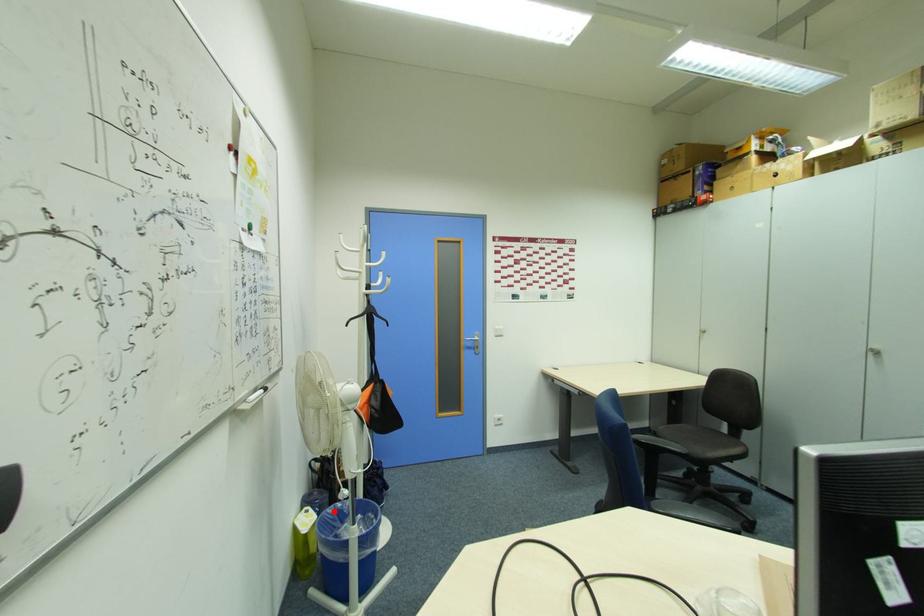
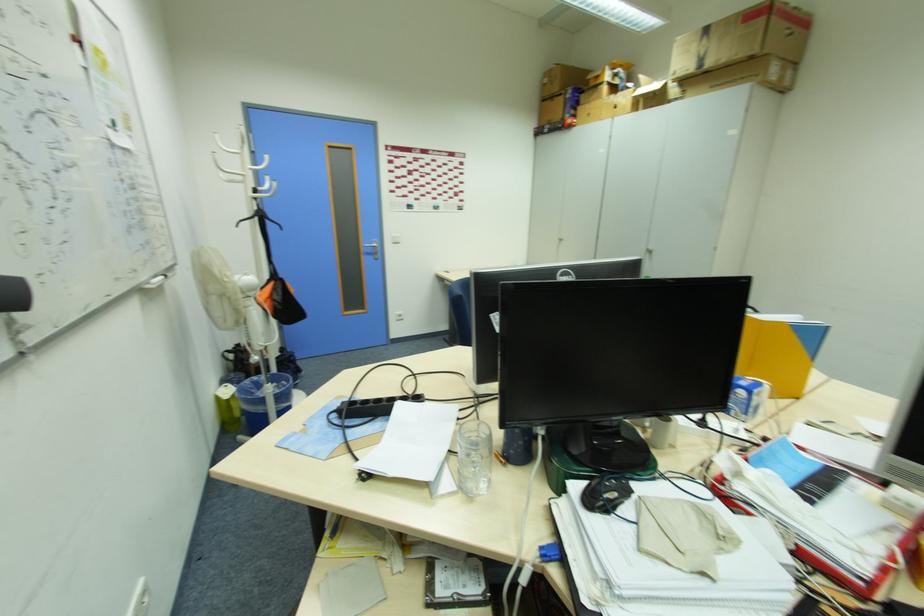
In the second image, find the point that corresponds to the highlighted location in the first image.

(249, 383)